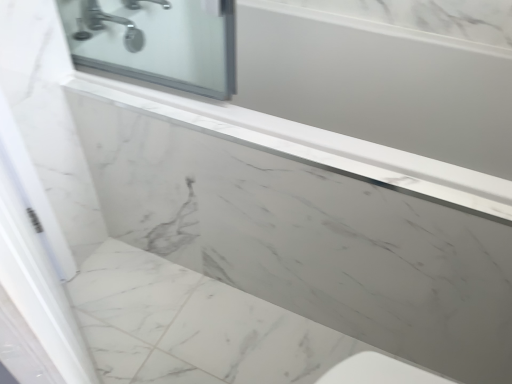
I want to click on free space to the back side of white marble screen door at left, so click(137, 300).